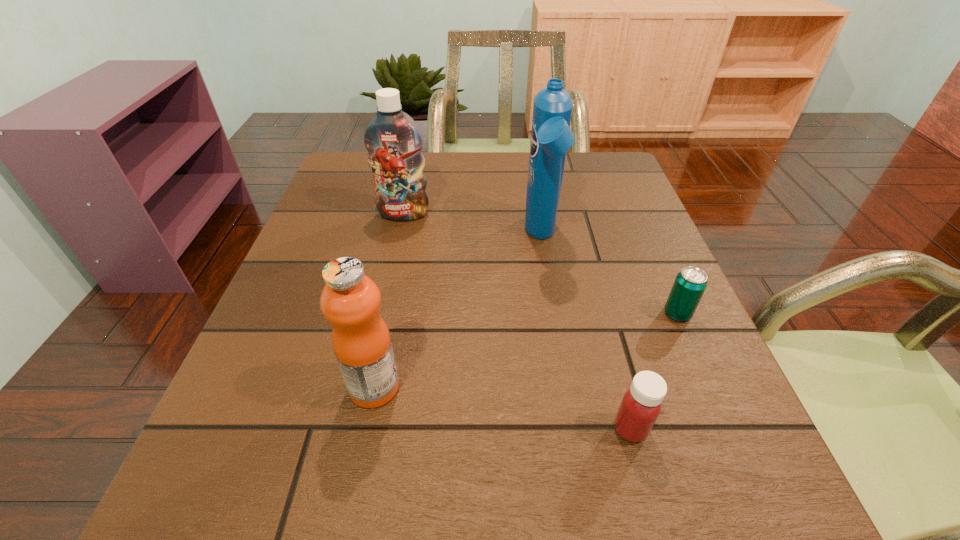
Locate an element on the screen. This screenshot has height=540, width=960. the right shampoo is located at coordinates (551, 137).

The height and width of the screenshot is (540, 960). I want to click on the left shampoo, so click(x=394, y=142).

Where is `fruit juice`? The height and width of the screenshot is (540, 960). fruit juice is located at coordinates (350, 300).

At what (x,y) coordinates should I click in order to perform the action: click on the second shortest object. Please return your answer as a coordinate pair (x, y). Looking at the image, I should click on (641, 404).

Find the location of a particular element. This screenshot has height=540, width=960. the nearest object is located at coordinates (641, 404).

What are the coordinates of `beer can` in the screenshot? It's located at (688, 288).

I want to click on the third farthest object, so click(688, 288).

Identify the location of vacant region located 0.220m on the front of the right shampoo. The image size is (960, 540). (560, 351).

What are the coordinates of `free space located 0.260m on the front label of the left shampoo` in the screenshot? It's located at (384, 304).

Locate an element on the screen. The height and width of the screenshot is (540, 960). free space located on the right of the fruit juice is located at coordinates (628, 387).